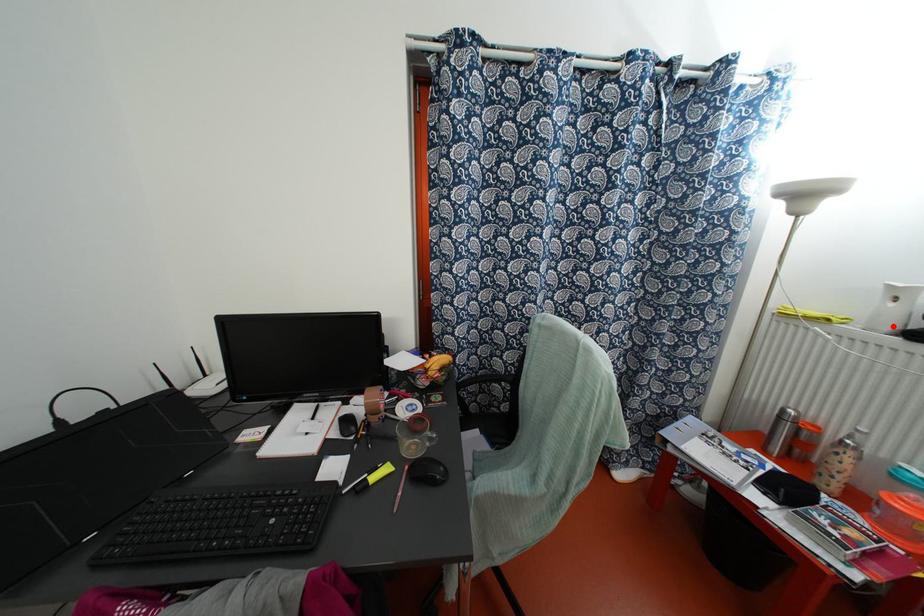
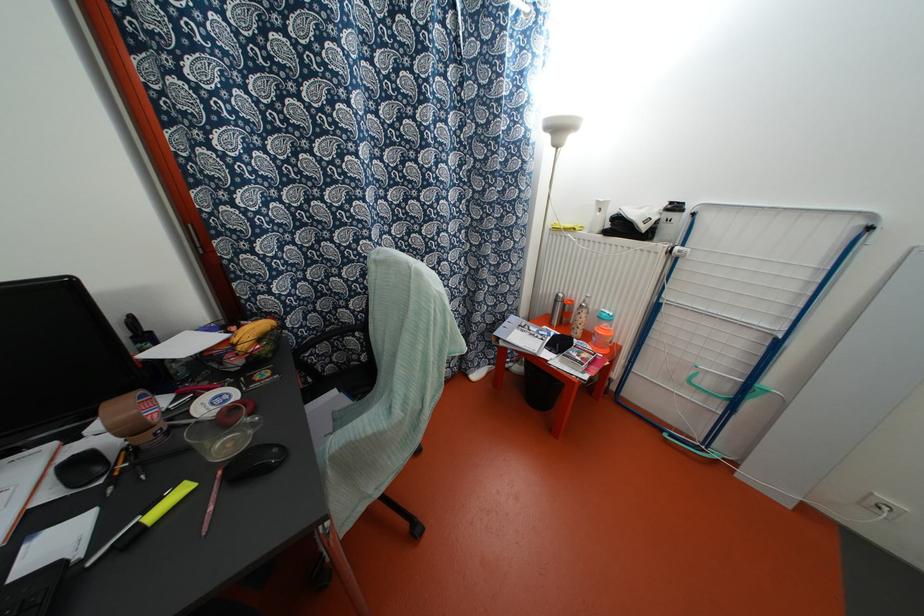
Question: A red point is marked in image1. In image2, is the corresponding 3D point closer to the camera or farther? Reply with the corresponding letter.

Choices:
 (A) The corresponding 3D point is closer.
 (B) The corresponding 3D point is farther.

Answer: (A)